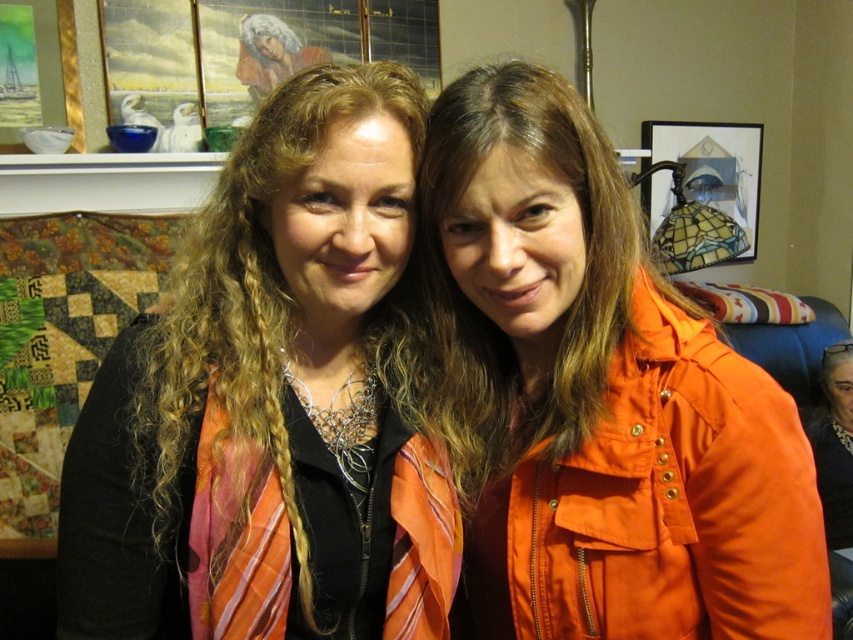
Question: Is orange fabric scarf at left to the left of orange matte jacket at center from the viewer's perspective?

Choices:
 (A) no
 (B) yes

Answer: (B)

Question: Does orange fabric scarf at left have a lesser width compared to orange matte jacket at center?

Choices:
 (A) no
 (B) yes

Answer: (A)

Question: Which point is farther from the camera taking this photo?

Choices:
 (A) (776, 612)
 (B) (276, 348)

Answer: (B)

Question: Is the position of orange fabric scarf at left less distant than that of orange matte jacket at center?

Choices:
 (A) no
 (B) yes

Answer: (B)

Question: Which object is closer to the camera taking this photo?

Choices:
 (A) orange matte jacket at center
 (B) orange fabric scarf at left

Answer: (B)